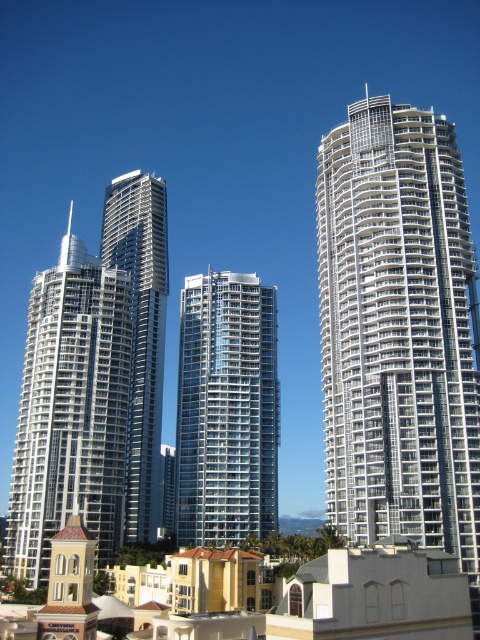
Question: Considering the real-world distances, which object is closest to the white glass building at center?

Choices:
 (A) glassy steel building at center
 (B) white glass skyscraper at left
 (C) silver metallic skyscraper at center

Answer: (A)

Question: Does white glass skyscraper at left appear over silver metallic skyscraper at center?

Choices:
 (A) yes
 (B) no

Answer: (A)

Question: Considering the relative positions of white glass building at center and white glass skyscraper at left in the image provided, where is white glass building at center located with respect to white glass skyscraper at left?

Choices:
 (A) below
 (B) above

Answer: (A)

Question: Is white glass skyscraper at left below silver metallic skyscraper at center?

Choices:
 (A) yes
 (B) no

Answer: (B)

Question: Which object is farther from the camera taking this photo?

Choices:
 (A) silver metallic skyscraper at center
 (B) white glass skyscraper at left
 (C) glassy steel building at center
 (D) white glass building at center

Answer: (C)

Question: Among these objects, which one is nearest to the camera?

Choices:
 (A) white glass skyscraper at left
 (B) white glass building at center
 (C) silver metallic skyscraper at center

Answer: (B)